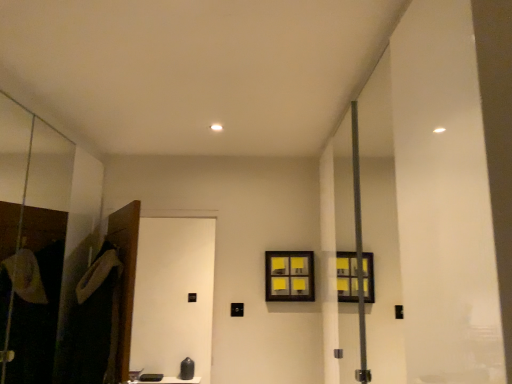
Question: Should I look upward or downward to see black matte screen door at lower left, which is the 2th screen door in left-to-right order?

Choices:
 (A) down
 (B) up

Answer: (A)

Question: Would you say dark gray fabric robe at left is outside yellow sticky notes at center?

Choices:
 (A) yes
 (B) no

Answer: (A)

Question: Considering the relative positions of dark gray fabric robe at left and yellow sticky notes at center in the image provided, is dark gray fabric robe at left to the right of yellow sticky notes at center from the viewer's perspective?

Choices:
 (A) yes
 (B) no

Answer: (B)

Question: Is dark gray fabric robe at left positioned with its back to yellow sticky notes at center?

Choices:
 (A) no
 (B) yes

Answer: (A)

Question: Is dark gray fabric robe at left far away from yellow sticky notes at center?

Choices:
 (A) no
 (B) yes

Answer: (B)

Question: From a real-world perspective, is dark gray fabric robe at left on top of yellow sticky notes at center?

Choices:
 (A) no
 (B) yes

Answer: (A)

Question: From the image's perspective, is dark gray fabric robe at left below yellow sticky notes at center?

Choices:
 (A) yes
 (B) no

Answer: (A)

Question: Is black matte screen door at lower left, which is the 2th screen door in left-to-right order, taller than yellow sticky notes at center?

Choices:
 (A) no
 (B) yes

Answer: (B)

Question: Can you confirm if black matte screen door at lower left, which appears as the 1th screen door when viewed from the right, is positioned to the right of yellow sticky notes at center?

Choices:
 (A) no
 (B) yes

Answer: (A)

Question: Does black matte screen door at lower left, which is the 2th screen door in left-to-right order, turn towards yellow sticky notes at center?

Choices:
 (A) no
 (B) yes

Answer: (A)

Question: From a real-world perspective, is black matte screen door at lower left, which is the 2th screen door in left-to-right order, over yellow sticky notes at center?

Choices:
 (A) no
 (B) yes

Answer: (A)

Question: Can you confirm if black matte screen door at lower left, which is the 2th screen door in left-to-right order, is shorter than yellow sticky notes at center?

Choices:
 (A) yes
 (B) no

Answer: (B)

Question: Is black matte screen door at lower left, which is the 2th screen door in left-to-right order, positioned before yellow sticky notes at center?

Choices:
 (A) no
 (B) yes

Answer: (B)

Question: Are transparent glass screen door at left, the 1th screen door viewed from the left, and yellow sticky notes at center beside each other?

Choices:
 (A) no
 (B) yes

Answer: (A)